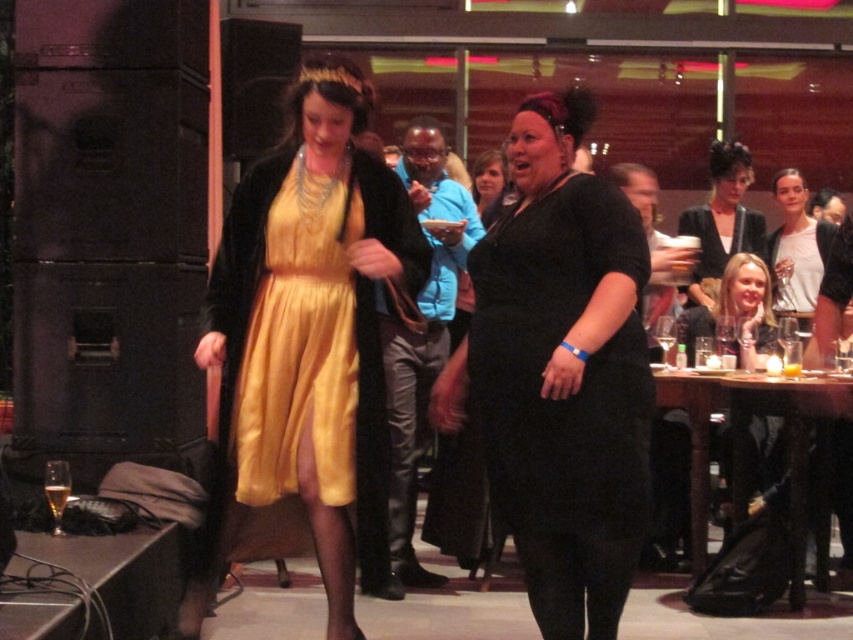
Question: Is blue quilted jacket at center behind matte black dress at upper right?

Choices:
 (A) yes
 (B) no

Answer: (B)

Question: Can you confirm if blue quilted jacket at center is positioned to the right of matte black dress at center?

Choices:
 (A) yes
 (B) no

Answer: (B)

Question: Which object appears farthest from the camera in this image?

Choices:
 (A) matte black dress at lower right
 (B) satin yellow dress at center
 (C) matte black dress at upper right
 (D) white matte shirt at upper right

Answer: (C)

Question: Considering the relative positions of matte black dress at center and matte black dress at upper right in the image provided, where is matte black dress at center located with respect to matte black dress at upper right?

Choices:
 (A) below
 (B) above

Answer: (A)

Question: Which point is farther from the camera taking this photo?

Choices:
 (A) (724, 152)
 (B) (573, 525)
 (C) (412, 508)

Answer: (A)

Question: Based on their relative distances, which object is farther from the black leather pants at center?

Choices:
 (A) matte black dress at center
 (B) blue quilted jacket at center
 (C) satin gold dress at center

Answer: (A)